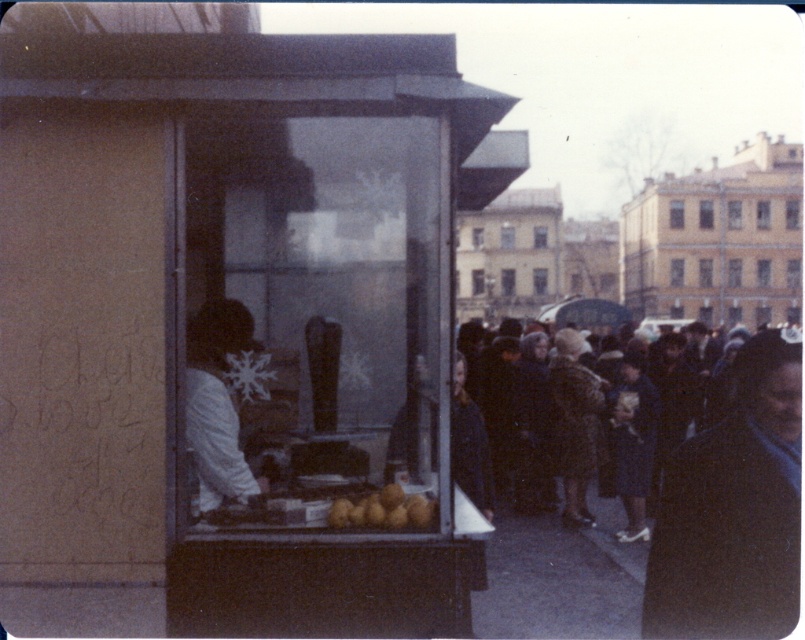
In the bustling outdoor market scene, you see a dark gray coat at center and yellow matte potatoes at center. Which object is placed above the other?

The dark gray coat at center is positioned over yellow matte potatoes at center, so the dark gray coat is above the potatoes.